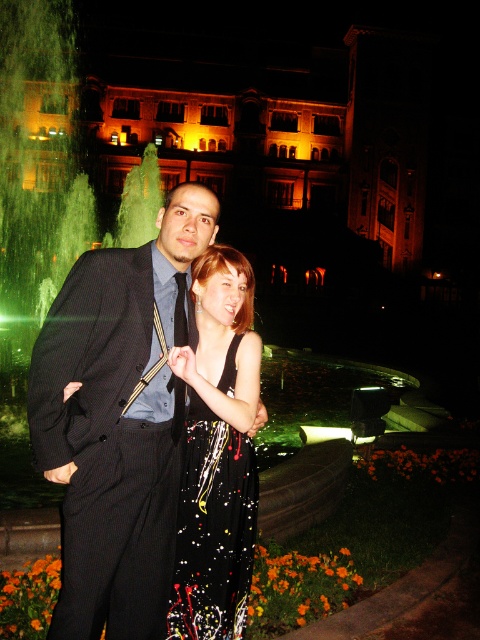
Question: Can you confirm if black pinstripe suit at center is thinner than sparkly black dress at center?

Choices:
 (A) no
 (B) yes

Answer: (A)

Question: From the image, what is the correct spatial relationship of black pinstripe suit at center in relation to sparkly black dress at center?

Choices:
 (A) right
 (B) left

Answer: (B)

Question: Which of the following is the closest to the observer?

Choices:
 (A) black pinstripe suit at center
 (B) sparkly black dress at center

Answer: (A)

Question: Does black pinstripe suit at center have a greater width compared to sparkly black dress at center?

Choices:
 (A) no
 (B) yes

Answer: (B)

Question: Which object is closer to the camera taking this photo?

Choices:
 (A) black pinstripe suit at center
 (B) sparkly black dress at center

Answer: (A)